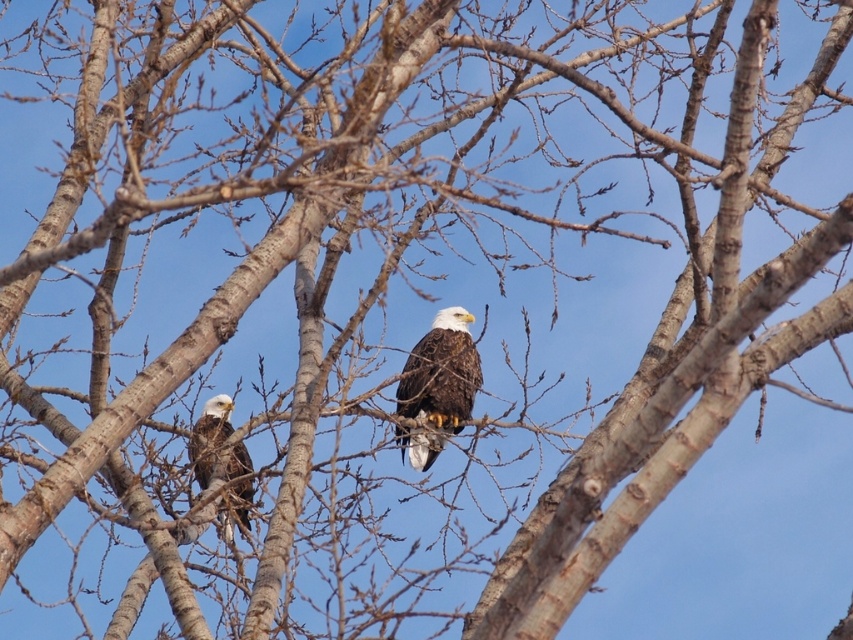
Question: Can you confirm if brown feathered eagle at center is wider than dark brown feathers at center?

Choices:
 (A) yes
 (B) no

Answer: (A)

Question: Can you confirm if brown feathered eagle at center is thinner than dark brown feathers at center?

Choices:
 (A) no
 (B) yes

Answer: (A)

Question: Among these objects, which one is nearest to the camera?

Choices:
 (A) brown feathered eagle at center
 (B) dark brown feathers at center

Answer: (B)

Question: In this image, where is brown feathered eagle at center located relative to dark brown feathers at center?

Choices:
 (A) left
 (B) right

Answer: (B)

Question: Which of the following is the farthest from the observer?

Choices:
 (A) dark brown feathers at center
 (B) brown feathered eagle at center

Answer: (B)

Question: Which of the following is the closest to the observer?

Choices:
 (A) (454, 360)
 (B) (216, 420)

Answer: (B)